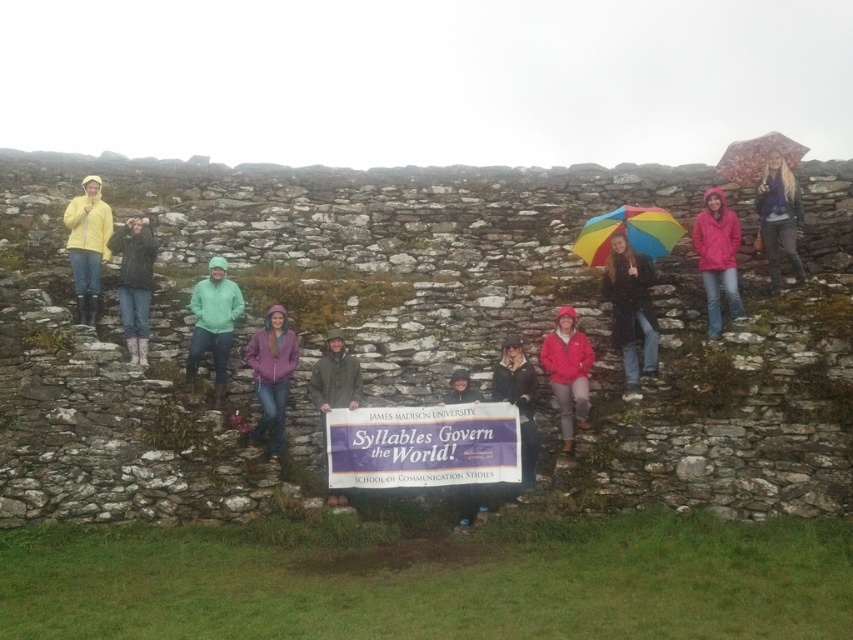
Does matte pink jacket at center have a smaller size compared to matte yellow raincoat at left?

Indeed, matte pink jacket at center has a smaller size compared to matte yellow raincoat at left.

Can you confirm if matte pink jacket at center is shorter than matte yellow raincoat at left?

Yes, matte pink jacket at center is shorter than matte yellow raincoat at left.

Find the location of a particular element. The image size is (853, 640). matte pink jacket at center is located at coordinates (567, 372).

Which is in front, point (627, 296) or point (468, 390)?

Positioned in front is point (468, 390).

Is point (639, 396) closer to viewer compared to point (474, 502)?

No, (639, 396) is behind (474, 502).

Which is behind, point (637, 275) or point (463, 372)?

Point (637, 275)

Identify the location of rainbow umbrella at upper right. The width and height of the screenshot is (853, 640). (630, 310).

Does point (756, 192) come in front of point (660, 240)?

No, (756, 192) is behind (660, 240).

Does matte purple jacket at upper right have a smaller size compared to rainbow fabric umbrella at upper center?

Correct, matte purple jacket at upper right occupies less space than rainbow fabric umbrella at upper center.

The height and width of the screenshot is (640, 853). Find the location of `matte purple jacket at upper right`. matte purple jacket at upper right is located at coordinates (x=779, y=218).